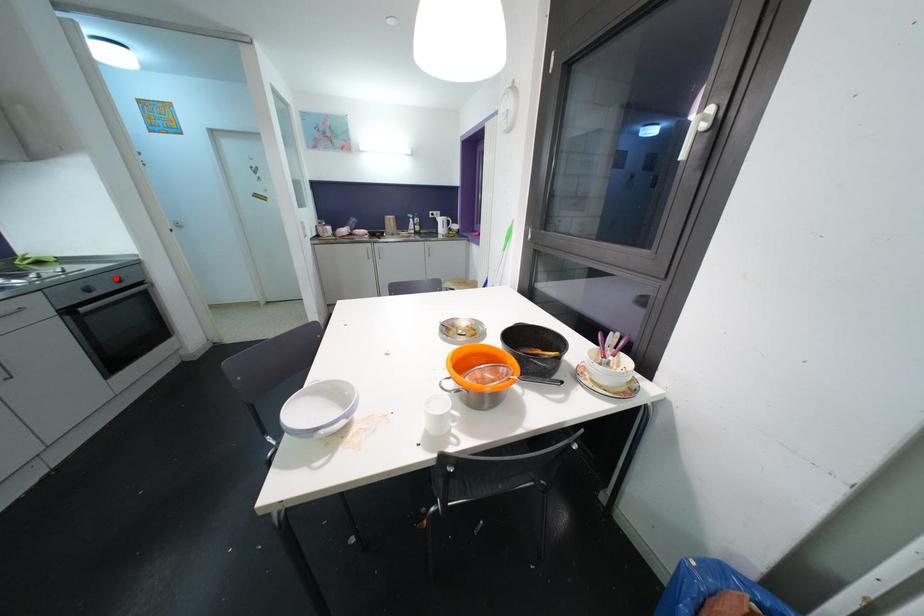
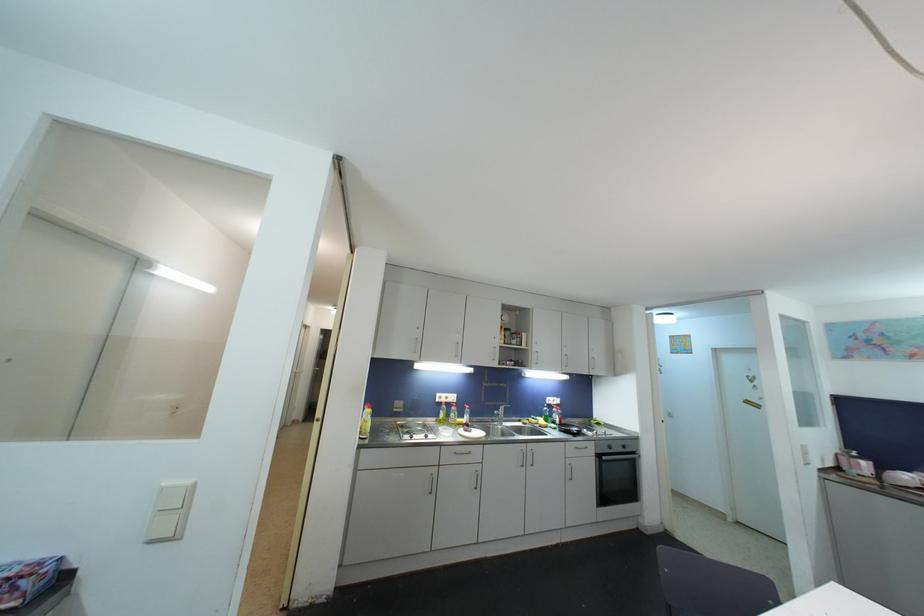
Find the pixel in the second image that matches the highlighted location in the first image.

(625, 445)